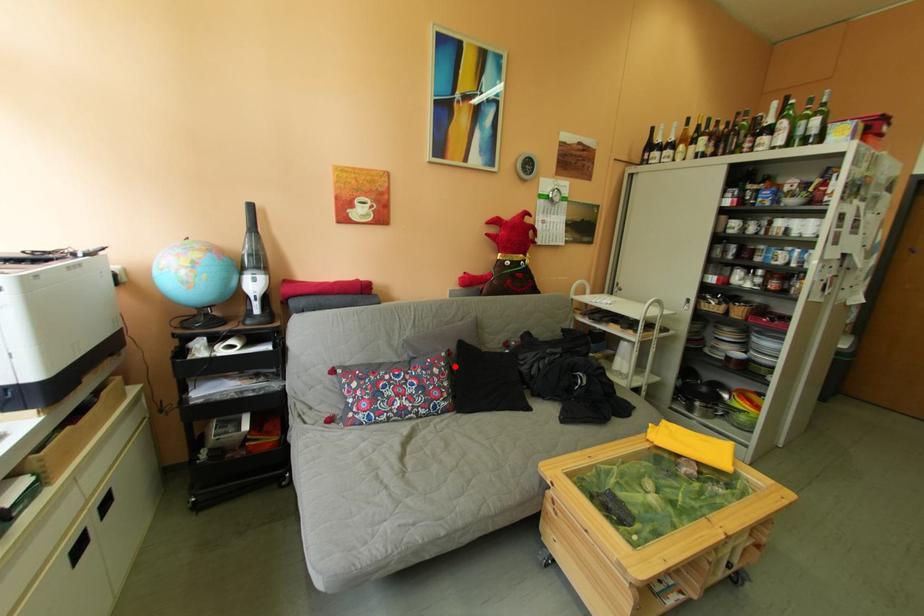
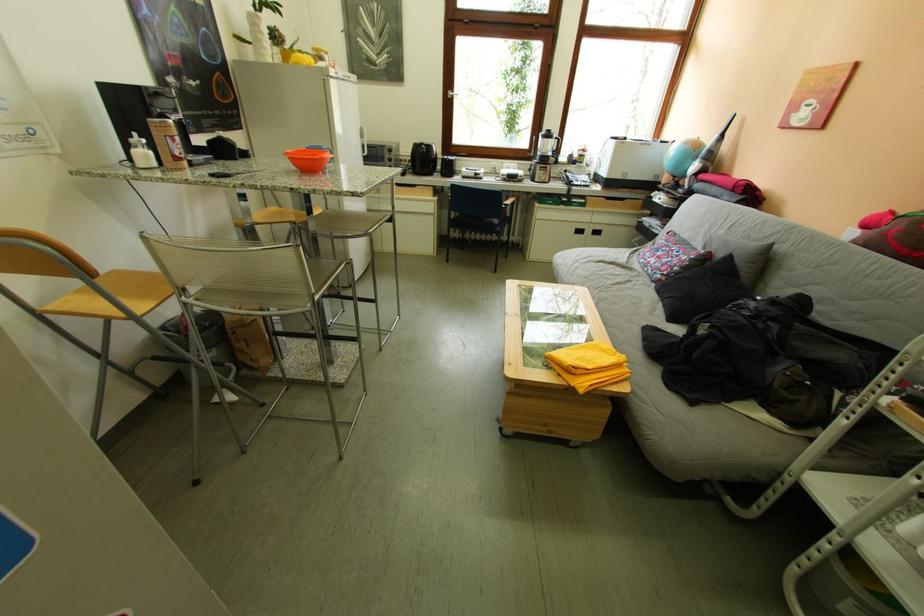
Locate, in the second image, the point that corresponds to the highlighted location in the first image.

(706, 259)